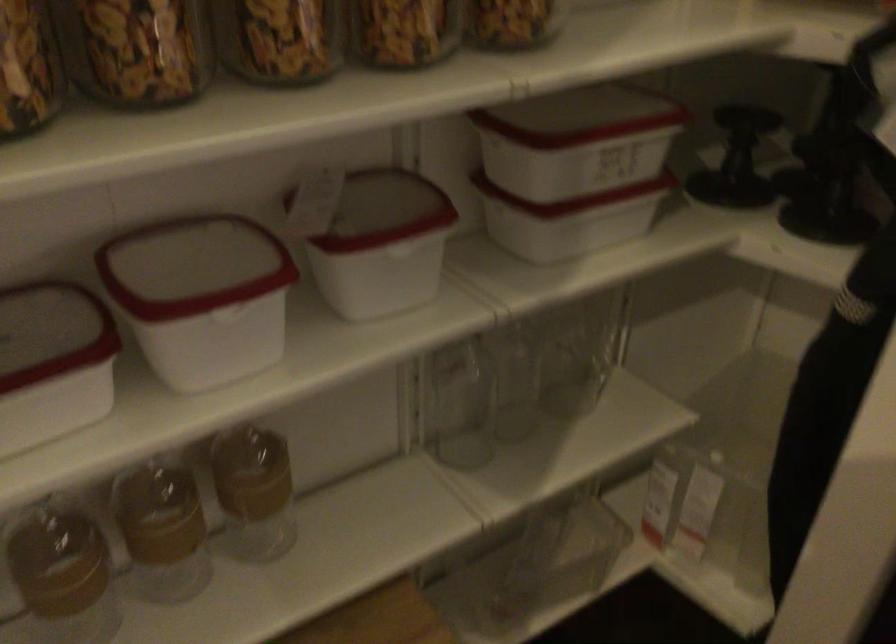
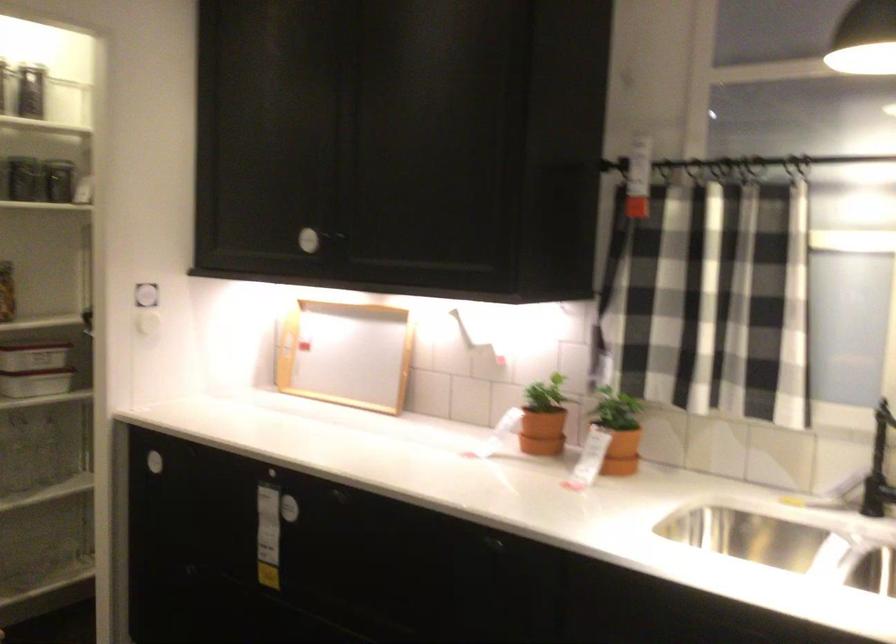
In the second image, find the point that corresponds to (602,202) in the first image.

(35, 368)